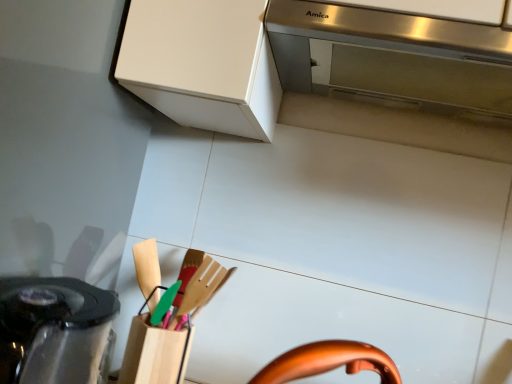
Question: Is stainless steel range hood at upper center in front of or behind black glossy kettle at lower left in the image?

Choices:
 (A) behind
 (B) front

Answer: (A)

Question: Looking at their shapes, would you say stainless steel range hood at upper center is wider or thinner than black glossy kettle at lower left?

Choices:
 (A) wide
 (B) thin

Answer: (A)

Question: Is stainless steel range hood at upper center to the left or to the right of black glossy kettle at lower left in the image?

Choices:
 (A) right
 (B) left

Answer: (A)

Question: Considering the positions of black glossy kettle at lower left and stainless steel range hood at upper center in the image, is black glossy kettle at lower left taller or shorter than stainless steel range hood at upper center?

Choices:
 (A) tall
 (B) short

Answer: (A)

Question: In terms of width, does black glossy kettle at lower left look wider or thinner when compared to stainless steel range hood at upper center?

Choices:
 (A) thin
 (B) wide

Answer: (A)

Question: Would you say black glossy kettle at lower left is to the left or to the right of stainless steel range hood at upper center in the picture?

Choices:
 (A) right
 (B) left

Answer: (B)

Question: Is black glossy kettle at lower left in front of or behind stainless steel range hood at upper center in the image?

Choices:
 (A) front
 (B) behind

Answer: (A)